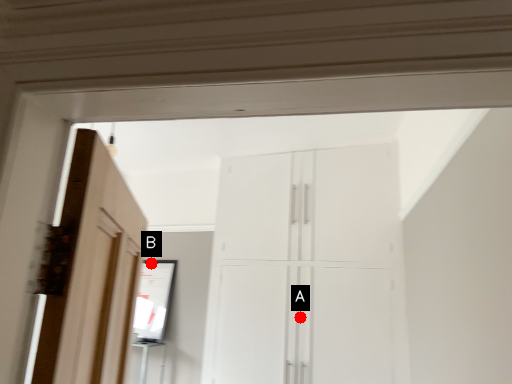
Question: Two points are circled on the image, labeled by A and B beside each circle. Which point is farther from the camera taking this photo?

Choices:
 (A) A is further
 (B) B is further

Answer: (B)